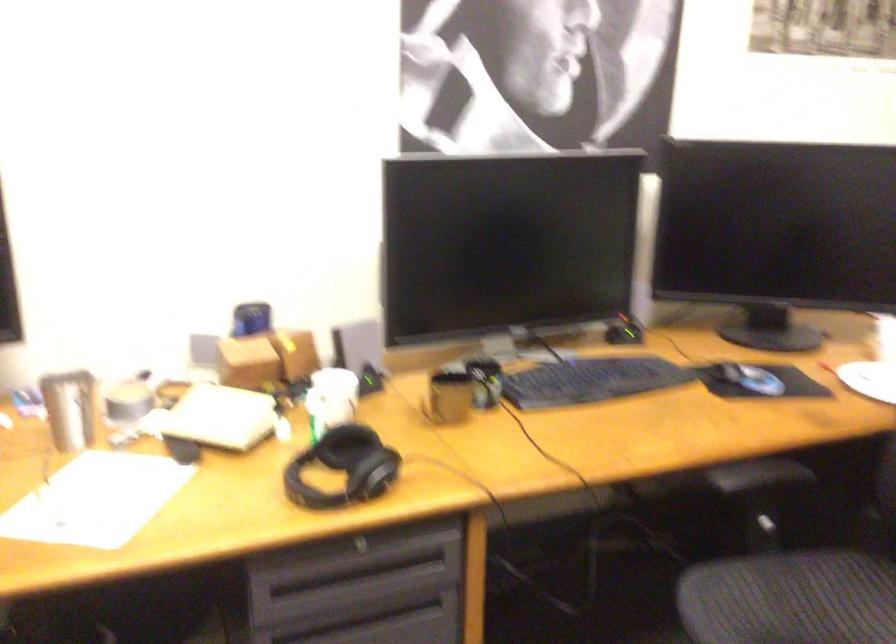
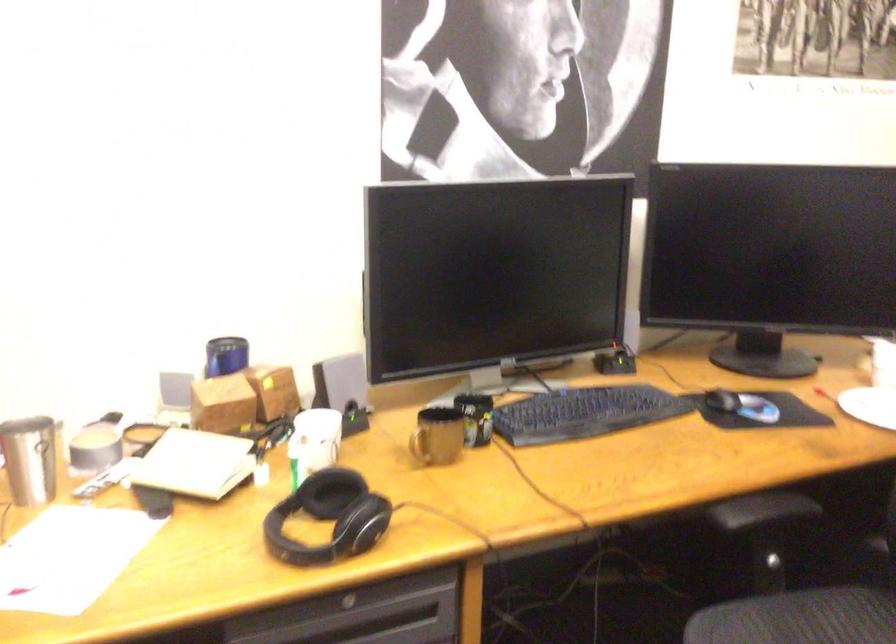
Find the pixel in the second image that matches (330,399) in the first image.

(314, 440)